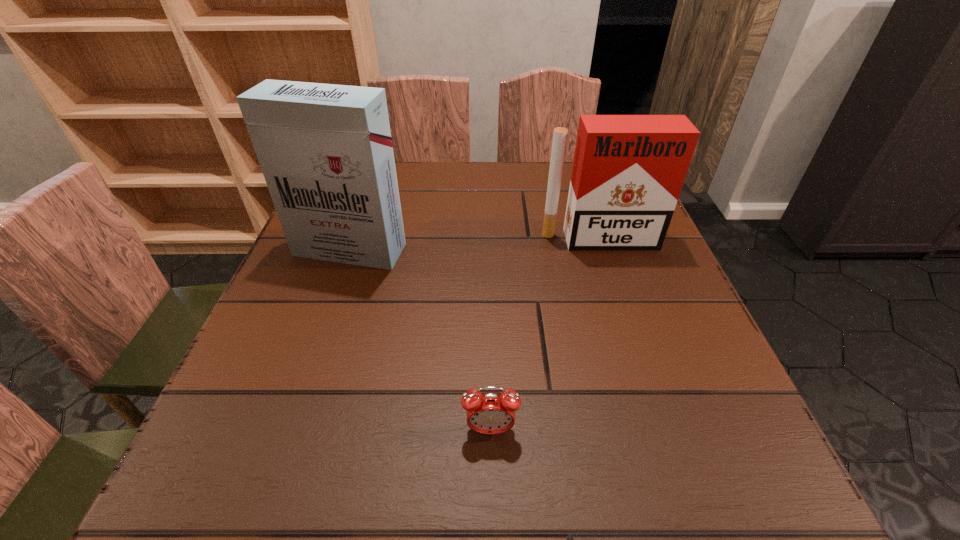
The image size is (960, 540). Find the location of `empty space that is in between the second object from right to left and the shorter cigarette case`. empty space that is in between the second object from right to left and the shorter cigarette case is located at coordinates (544, 335).

Identify the location of empty location between the rightmost object and the second object from left to right. Image resolution: width=960 pixels, height=540 pixels. (544, 335).

Where is `free space between the rightmost object and the tallest object`? free space between the rightmost object and the tallest object is located at coordinates (474, 245).

Where is `unoccupied area between the nearest object and the right cigarette case`? The width and height of the screenshot is (960, 540). unoccupied area between the nearest object and the right cigarette case is located at coordinates (544, 335).

Where is `vacant space that's between the shortest object and the right cigarette case`? The width and height of the screenshot is (960, 540). vacant space that's between the shortest object and the right cigarette case is located at coordinates (544, 335).

Find the location of a particular element. The width and height of the screenshot is (960, 540). vacant space in between the taller cigarette case and the second object from left to right is located at coordinates (420, 340).

Identify the location of the second closest object to the leftmost object. (490, 413).

Image resolution: width=960 pixels, height=540 pixels. What are the coordinates of `object that is the second nearest to the left cigarette case` in the screenshot? It's located at (490, 413).